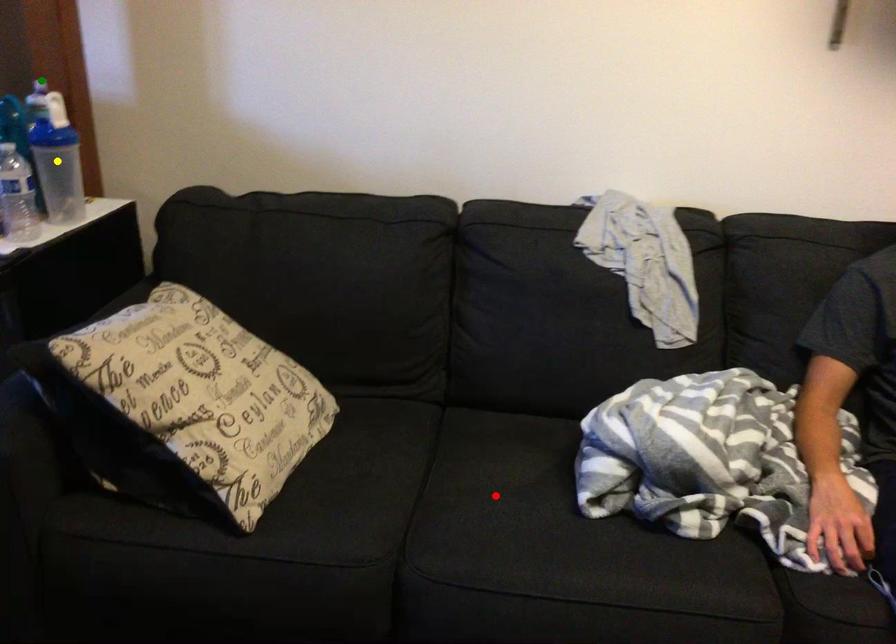
Order these from nearest to farthest:
red point
yellow point
green point

red point < yellow point < green point